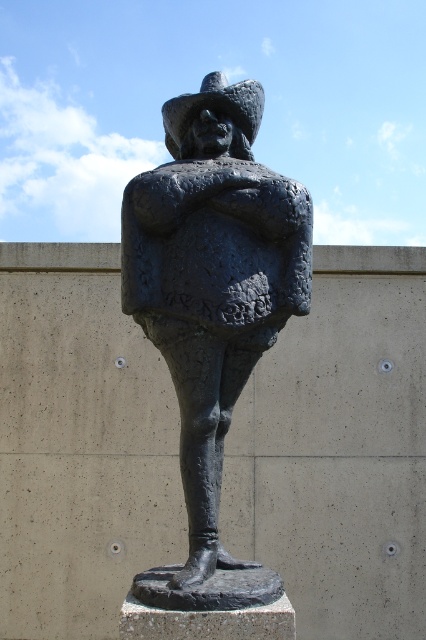
Based on the photo, based on the scene description, where is the bronze statue at center located in terms of its 2D coordinates?

The bronze statue at center is located at the 2D coordinates of point (213, 280).

You are standing in front of a bronze sculpture in a plaza. The sculpture is marked by the point at coordinates point (213, 280). If you want to take a photo of the sculpture with the plain concrete wall as the background, which direction should you face relative to the sculpture?

Since the bronze statue at center is represented by point (213, 280), you should face towards the plain concrete wall behind the sculpture to have it as the background in your photo.